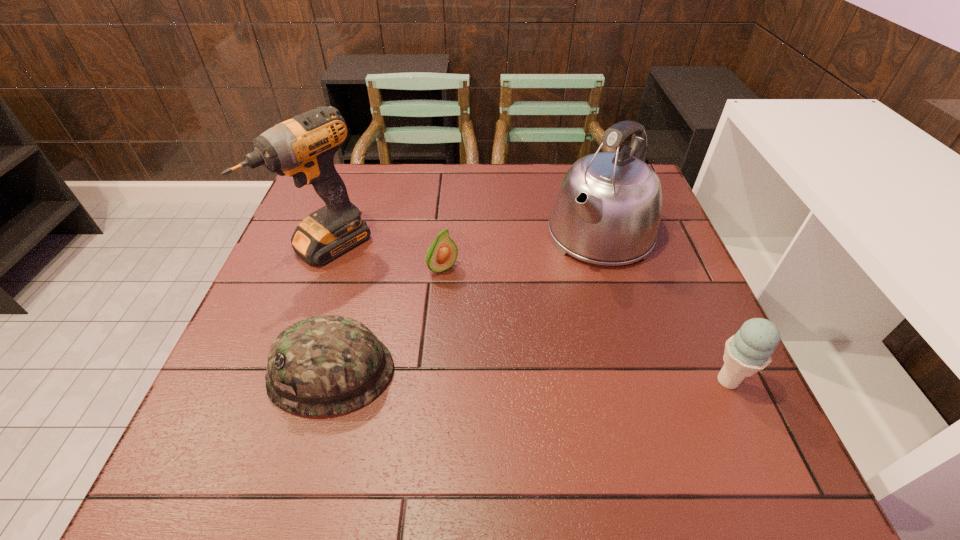
Image resolution: width=960 pixels, height=540 pixels. I want to click on drill present at the left edge, so click(303, 147).

Identify the location of ice cream located at the right edge. The height and width of the screenshot is (540, 960). (748, 351).

Find the location of a particular element. Image resolution: width=960 pixels, height=540 pixels. kettle that is at the right edge is located at coordinates (607, 210).

Image resolution: width=960 pixels, height=540 pixels. Identify the location of object that is at the near left corner. (326, 365).

At what (x,y) coordinates should I click in order to perform the action: click on object that is at the far right corner. Please return your answer as a coordinate pair (x, y). Looking at the image, I should click on (607, 210).

This screenshot has height=540, width=960. Find the location of `object at the near right corner`. object at the near right corner is located at coordinates (748, 351).

Locate an element on the screen. The width and height of the screenshot is (960, 540). vacant space at the far edge of the desktop is located at coordinates (484, 182).

Locate an element on the screen. vacant space at the near edge of the desktop is located at coordinates (548, 398).

You are a GUI agent. You are given a task and a screenshot of the screen. Output one action in this format:
    pyautogui.click(x=<x>, y=<y>)
    Task: Click on the vacant space at the left edge of the desktop
    
    Given the screenshot: What is the action you would take?
    pyautogui.click(x=318, y=305)

I want to click on blank space at the right edge, so click(699, 305).